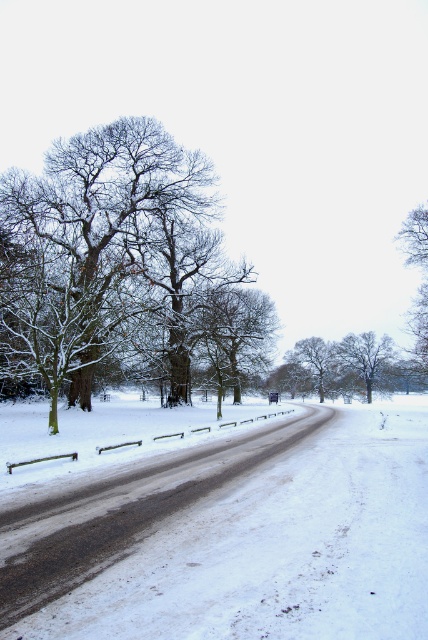
You are standing at the starting point of the snow covered road and want to reach the white powdery snow at center. Which direction should you move in to reach it?

The white powdery snow at center is located at point 0.858 on the x axis and 0.652 on the y axis. Since you are at the starting point of the road, you should move towards the center of the image where the snow is located.